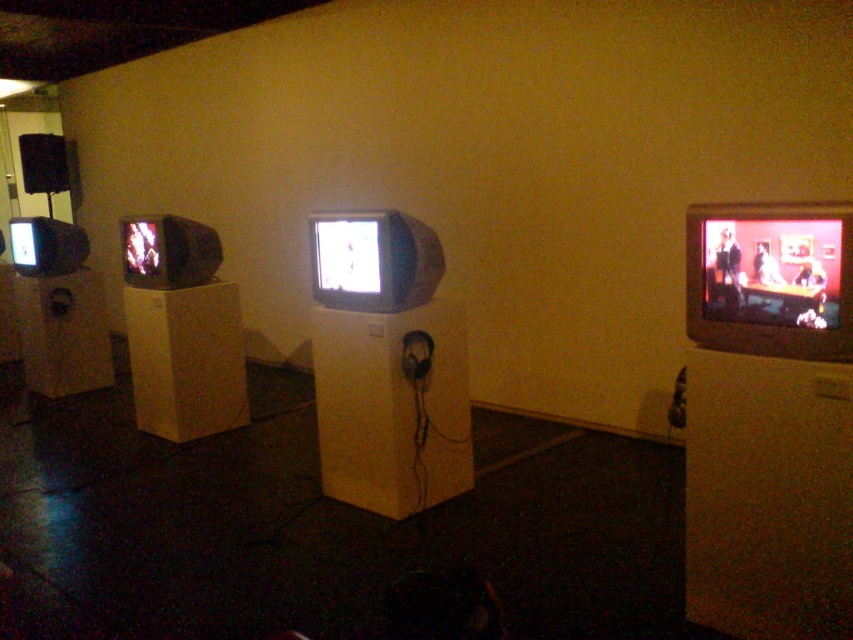
You are standing in the center of the room. You need to locate the matte black flat screen tv at right. According to the coordinates provided, where should you look relative to your position?

The matte black flat screen tv at right is located at coordinates 0.438 on the x axis and 0.904 on the y axis. Since you are standing at the center, you should look towards the right side of the room and slightly upwards to find it.

You are standing in the room and want to adjust the volume of the matte black flat screen tv at right. Considering your current position, can you reach it without moving closer than 2 meters?

The matte black flat screen tv at right is 2.23 meters from the viewer. Since the distance is more than 2 meters, you cannot reach it without moving closer.